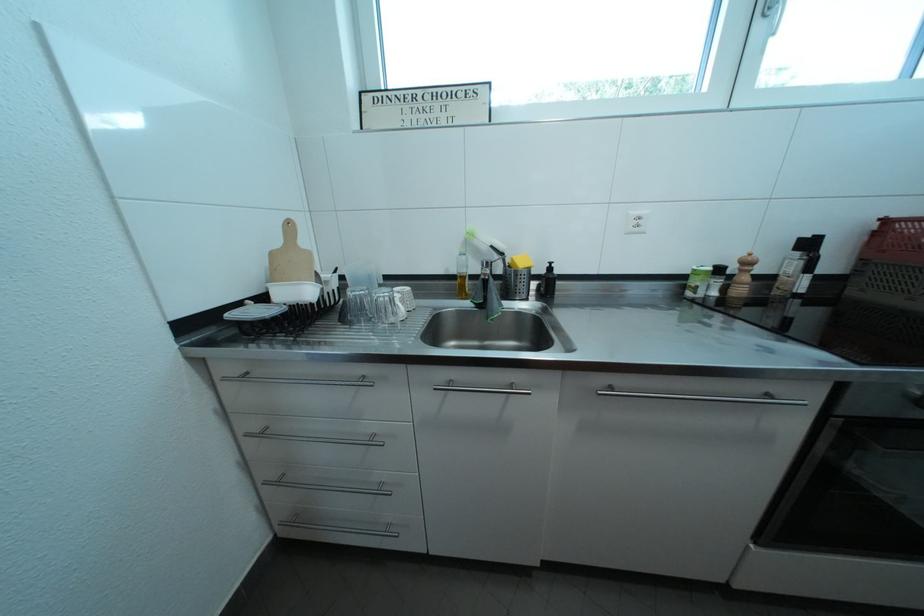
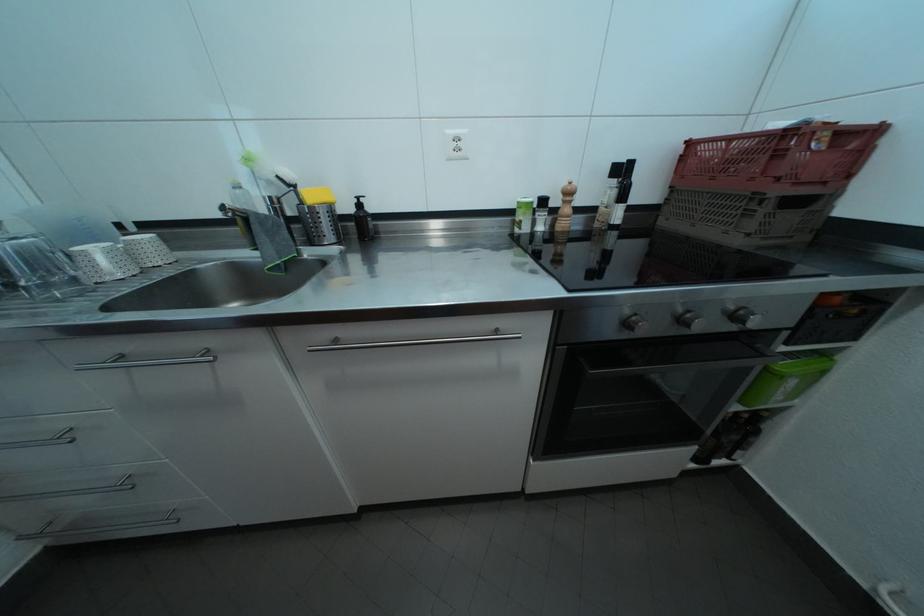
Find the pixel in the second image that matches point (275, 522) in the first image.

(18, 537)